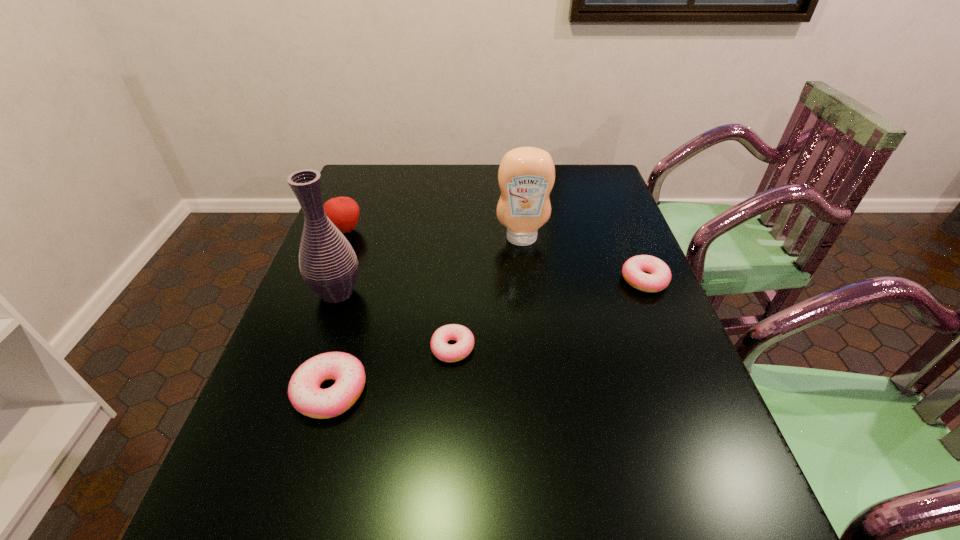
The image size is (960, 540). What are the coordinates of `the leftmost doughnut` in the screenshot? It's located at (304, 392).

In order to click on the fourth tallest object in this screenshot , I will do `click(304, 392)`.

Identify the location of the shortest object. This screenshot has height=540, width=960. (462, 335).

Locate an element on the screen. The height and width of the screenshot is (540, 960). the second doughnut from right to left is located at coordinates (462, 335).

Locate an element on the screen. The width and height of the screenshot is (960, 540). the rightmost object is located at coordinates (659, 277).

The image size is (960, 540). Identify the location of the fifth tallest object. (659, 277).

I want to click on the second tallest object, so click(526, 175).

The image size is (960, 540). I want to click on the fifth object from left to right, so click(x=526, y=175).

This screenshot has width=960, height=540. What are the coordinates of `apple` in the screenshot? It's located at [343, 211].

Where is `vase`? The width and height of the screenshot is (960, 540). vase is located at coordinates (328, 264).